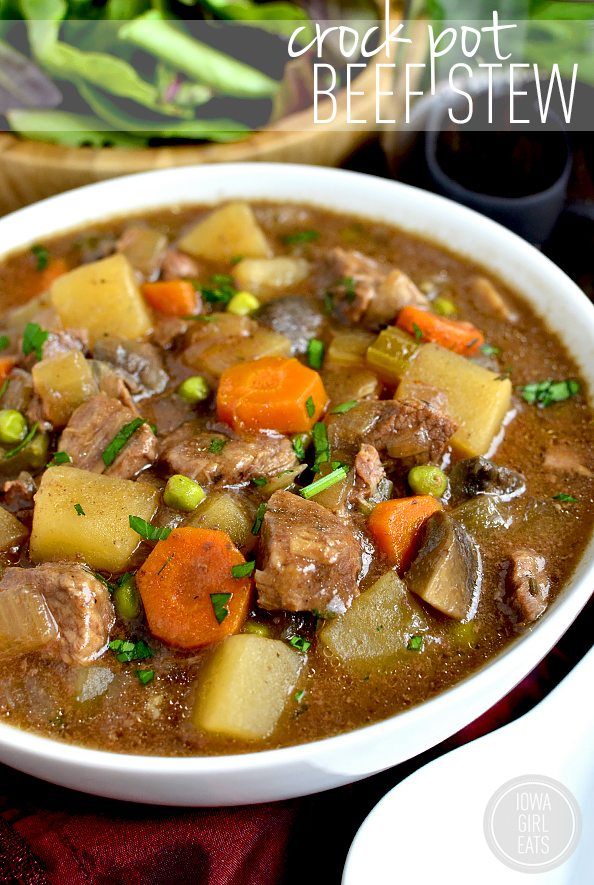
Locate an element on the screen. This screenshot has height=885, width=594. table cloth is located at coordinates (228, 845).